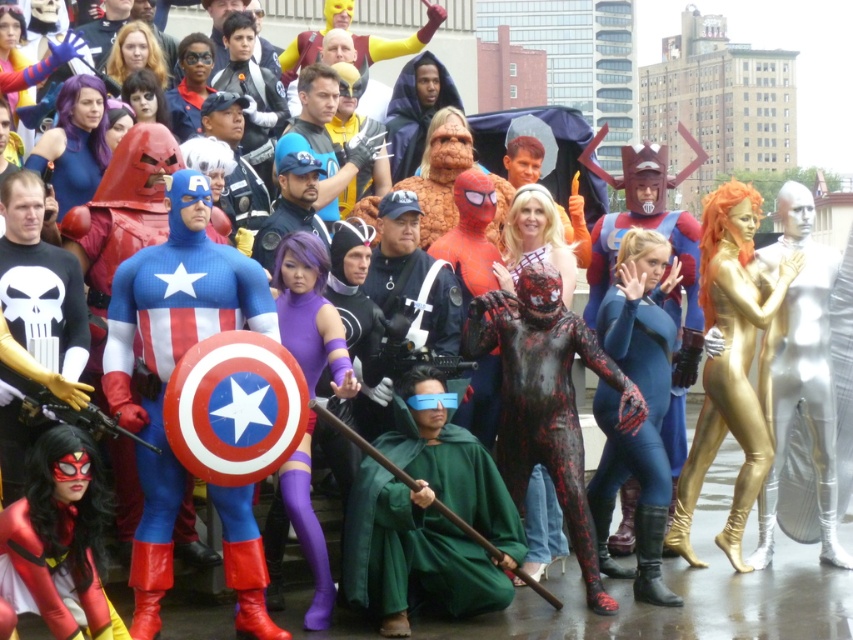
Question: Which point is closer to the camera?

Choices:
 (A) (355, 547)
 (B) (157, 419)

Answer: (B)

Question: Can you confirm if shiny spandex suit at center is positioned to the left of green velvet cloak at center?

Choices:
 (A) yes
 (B) no

Answer: (A)

Question: Can you confirm if shiny spandex suit at center is positioned above green velvet cloak at center?

Choices:
 (A) no
 (B) yes

Answer: (B)

Question: Which object is closer to the camera taking this photo?

Choices:
 (A) green velvet cloak at center
 (B) shiny spandex suit at center

Answer: (B)

Question: Which point is closer to the camera taking this photo?

Choices:
 (A) (132, 561)
 (B) (468, 516)

Answer: (A)

Question: Observing the image, what is the correct spatial positioning of shiny spandex suit at center in reference to green velvet cloak at center?

Choices:
 (A) below
 (B) above

Answer: (B)